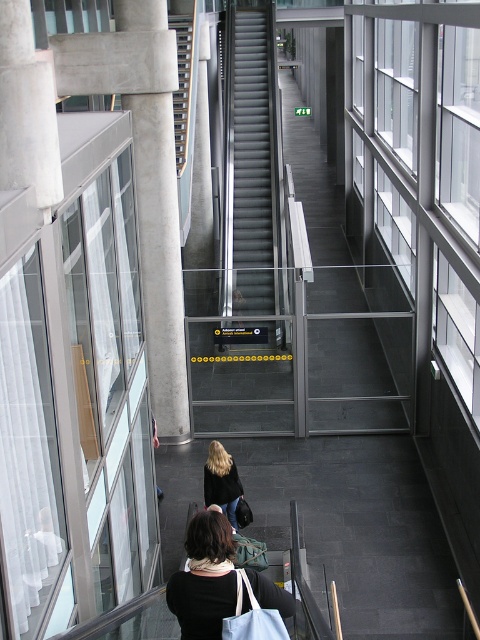
You are standing at the entrance of the transportation hub and see both the smooth gray stairs at center and the metallic gray stairs at center. Which one is positioned to the right side?

The smooth gray stairs at center is positioned to the right of the metallic gray stairs at center.

You are a person with the blonde hair at center. You want to walk down the metallic gray stairs at center. Can you safely step onto the stairs without bending over?

The metallic gray stairs at center is shorter than the blonde hair at center, so you can safely step onto the stairs without bending over since the stairs are not taller than your height.

You are standing at the bottom of the escalator and want to pick up both the black fabric bag at lower center and the blonde hair at center. Which one is closer to you?

The black fabric bag at lower center is closer to you because it is only 5.17 meters away from the blonde hair at center, but since you are at the bottom of the escalator, the exact distance from you to each object isn